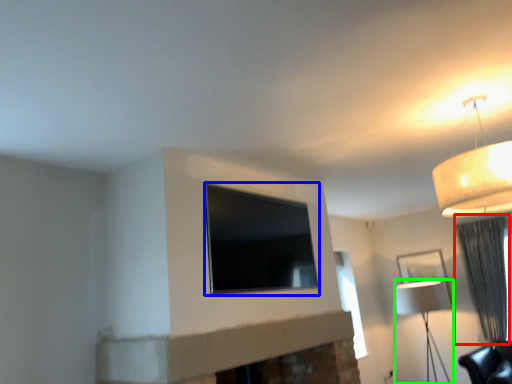
Question: Which object is positioned closest to curtain (highlighted by a red box)? Select from window (highlighted by a blue box) and lamp (highlighted by a green box).

Choices:
 (A) window
 (B) lamp

Answer: (B)